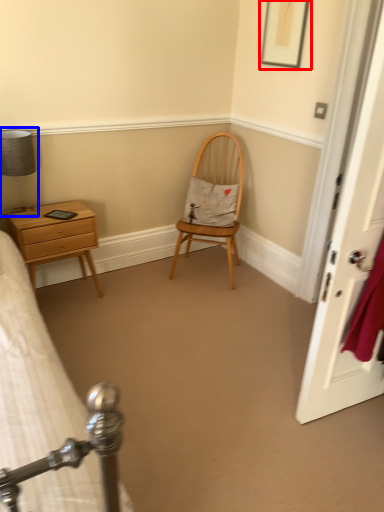
Question: Among these objects, which one is farthest to the camera, picture frame (highlighted by a red box) or bedside lamp (highlighted by a blue box)?

Choices:
 (A) picture frame
 (B) bedside lamp

Answer: (A)